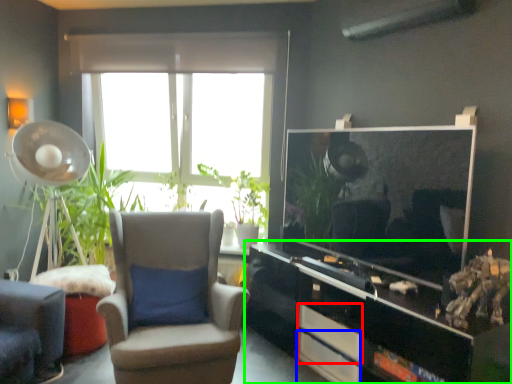
Question: Based on their relative distances, which object is farther from drawer (highlighted by a red box)? Choose from drawer (highlighted by a blue box) and cabinetry (highlighted by a green box).

Choices:
 (A) drawer
 (B) cabinetry

Answer: (B)